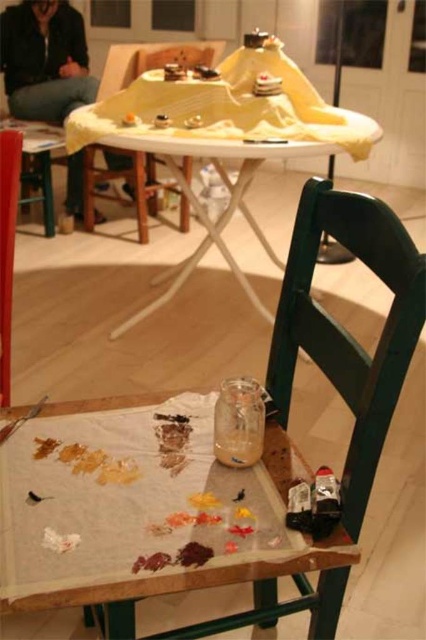
Question: Is the position of green wooden chair at lower right more distant than that of black leather jacket at upper left?

Choices:
 (A) yes
 (B) no

Answer: (B)

Question: Which of these objects is positioned closest to the white fabric-covered table at center?

Choices:
 (A) black leather jacket at upper left
 (B) green wooden chair at center

Answer: (B)

Question: Considering the relative positions of black leather jacket at upper left and green wooden chair at center in the image provided, where is black leather jacket at upper left located with respect to green wooden chair at center?

Choices:
 (A) above
 (B) below

Answer: (A)

Question: Which object is closer to the camera taking this photo?

Choices:
 (A) wooden table at lower center
 (B) white fabric-covered table at center
 (C) green wooden chair at center
 (D) black leather jacket at upper left

Answer: (A)

Question: Estimate the real-world distances between objects in this image. Which object is closer to the black leather jacket at upper left?

Choices:
 (A) green wooden chair at center
 (B) green wooden chair at lower right
 (C) white fabric-covered table at center

Answer: (A)

Question: Is wooden table at lower center to the right of green wooden chair at lower right from the viewer's perspective?

Choices:
 (A) no
 (B) yes

Answer: (A)